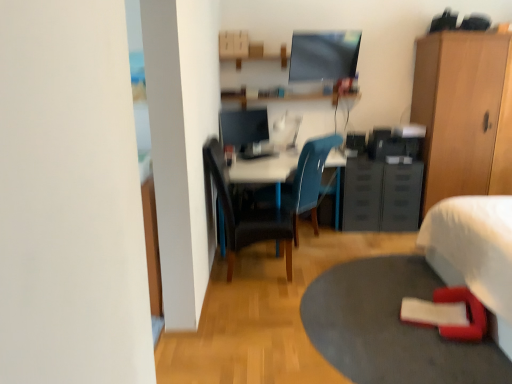
Identify the location of free space above rubberized red mat at lower right (from a real-world perspective). (377, 301).